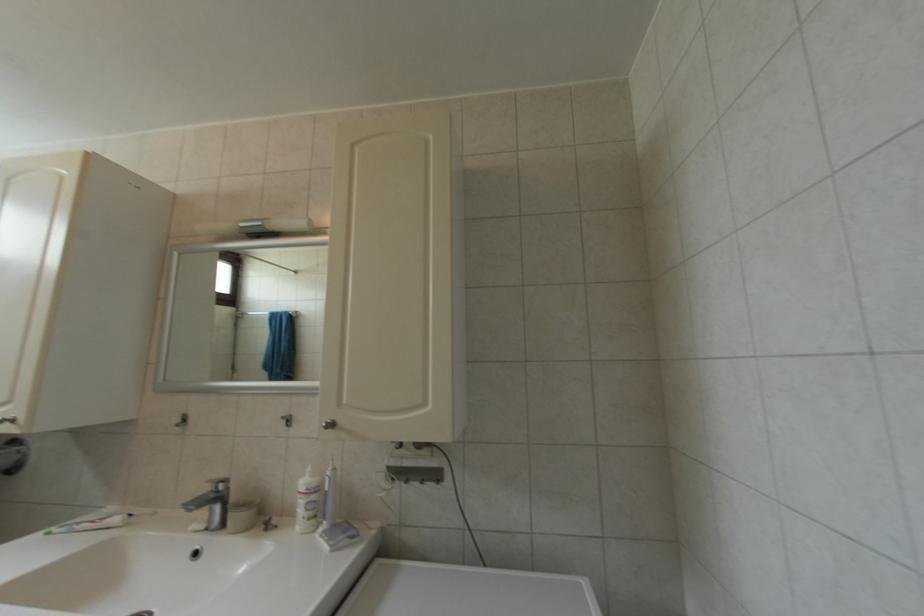
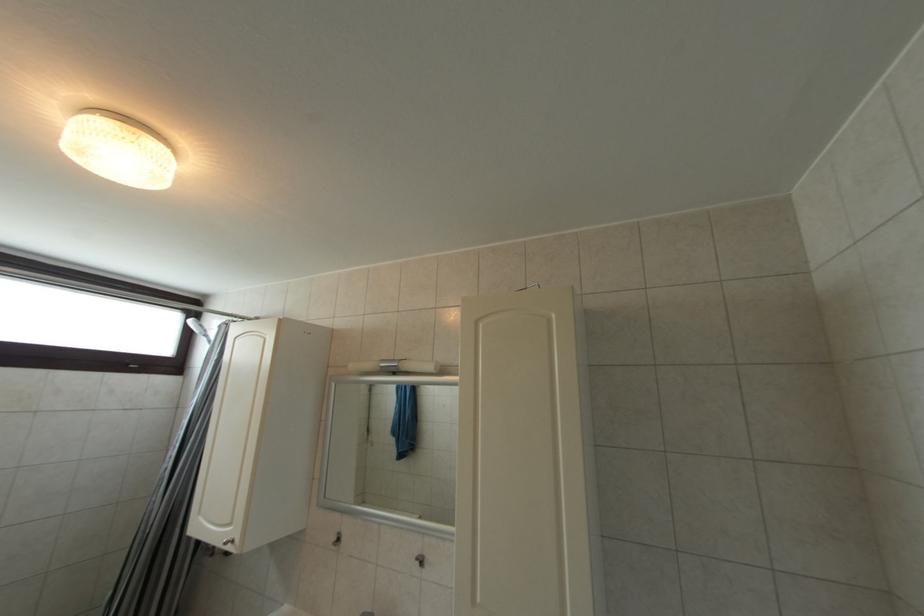
What movement of the cameraman would produce the second image?

The movement direction of the cameraman is left, backward.